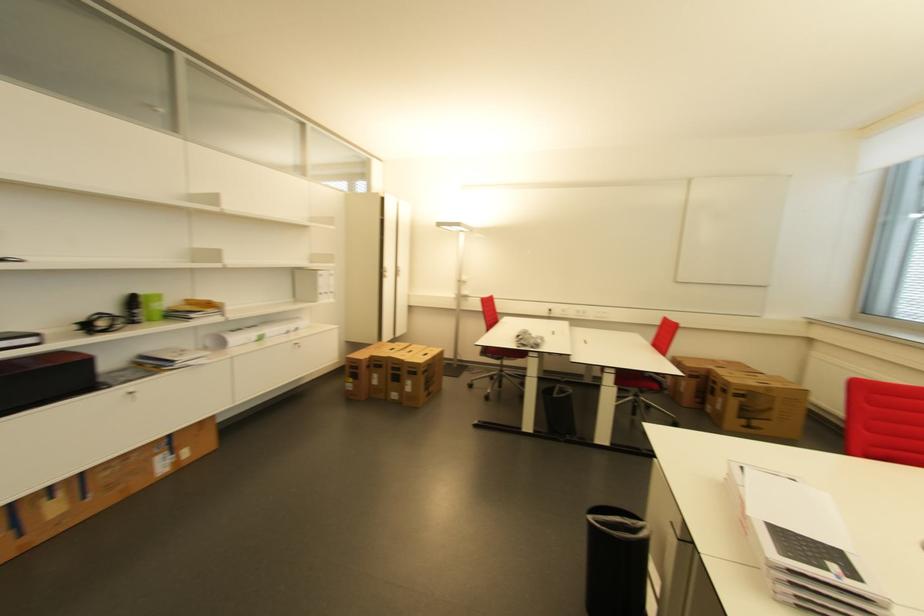
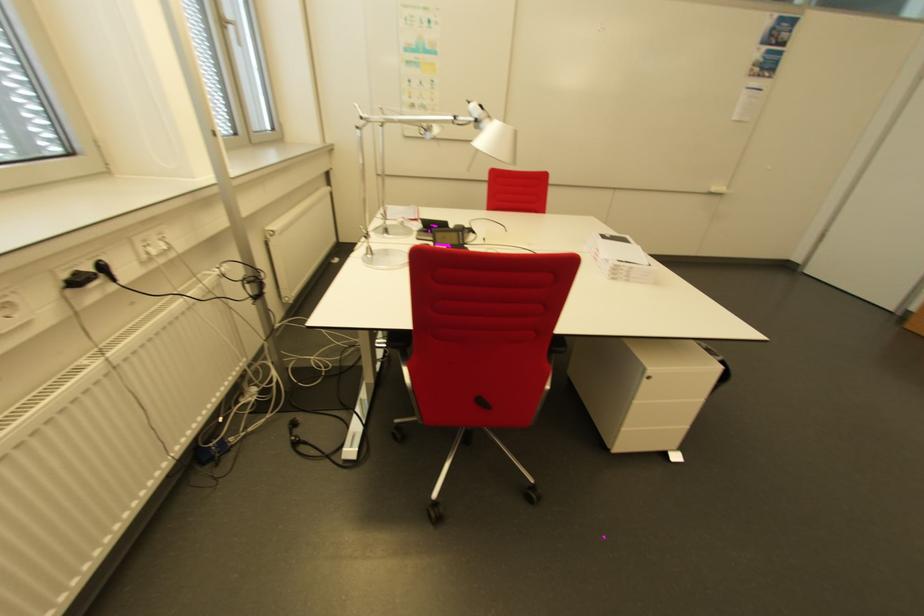
In the second image, find the point that corresponds to (x=840, y=567) in the first image.

(614, 237)